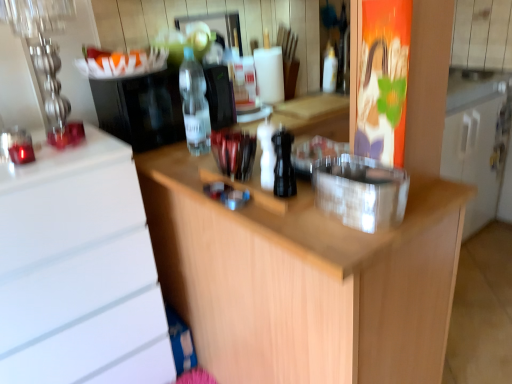
Find the location of a particular element. vacant space to the left of black matte pepper grinder at center, which ranks as the 2th bottle in left-to-right order is located at coordinates (247, 190).